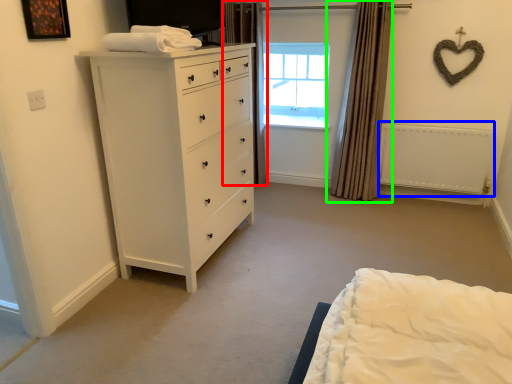
Question: Which is nearer to the curtain (highlighted by a red box)? radiator (highlighted by a blue box) or curtain (highlighted by a green box).

Choices:
 (A) radiator
 (B) curtain

Answer: (B)